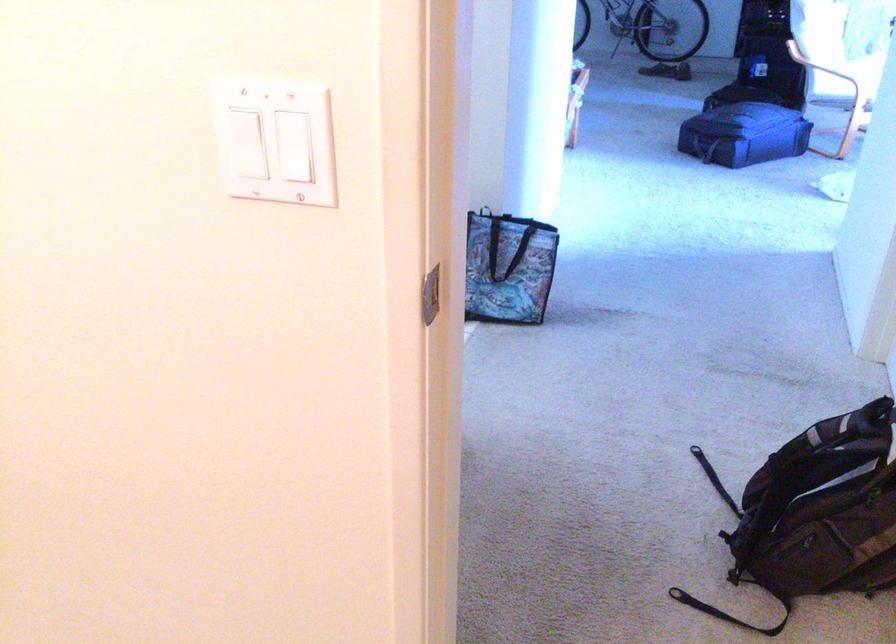
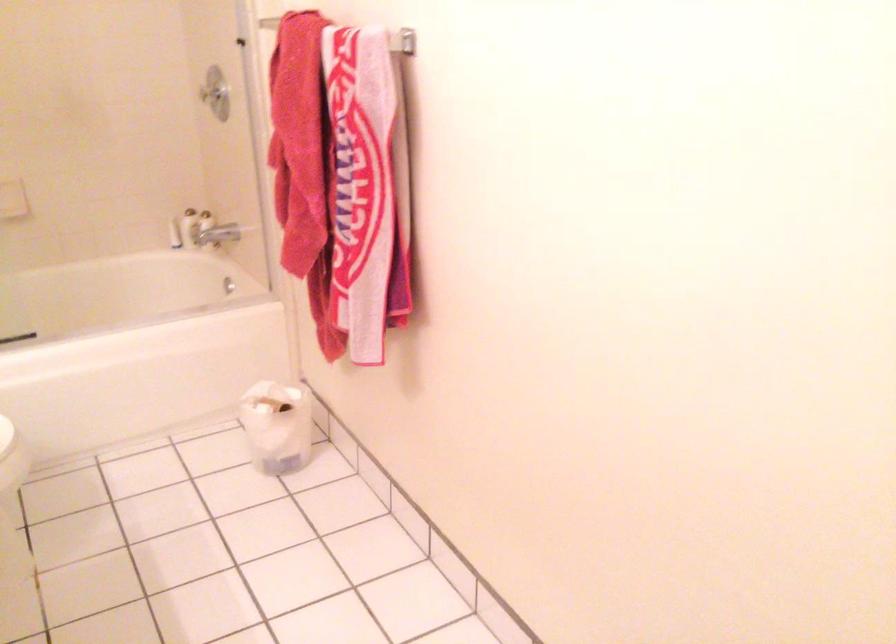
Question: Based on the continuous images, in which direction is the camera rotating? Reply with the corresponding letter.

Choices:
 (A) Left
 (B) Right
 (C) Up
 (D) Down

Answer: (A)